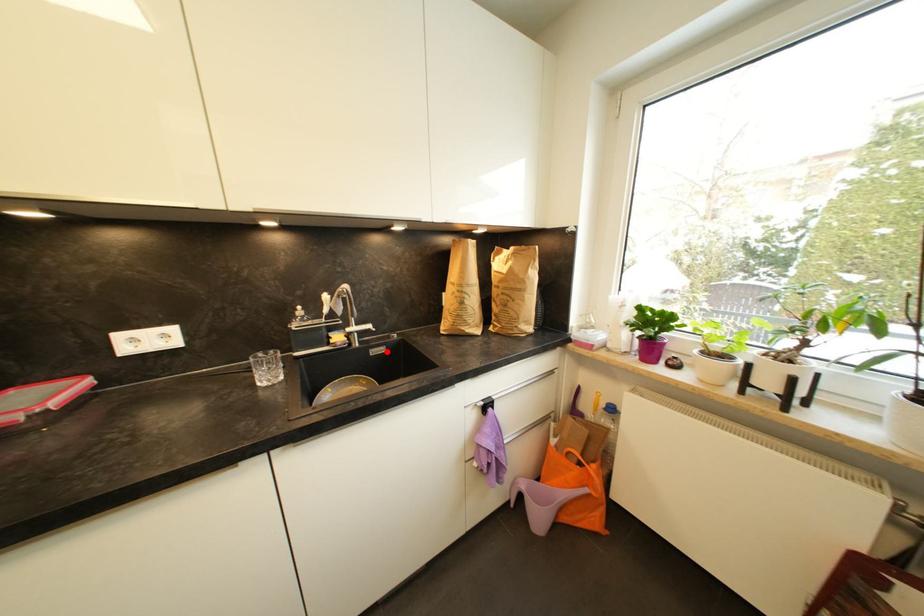
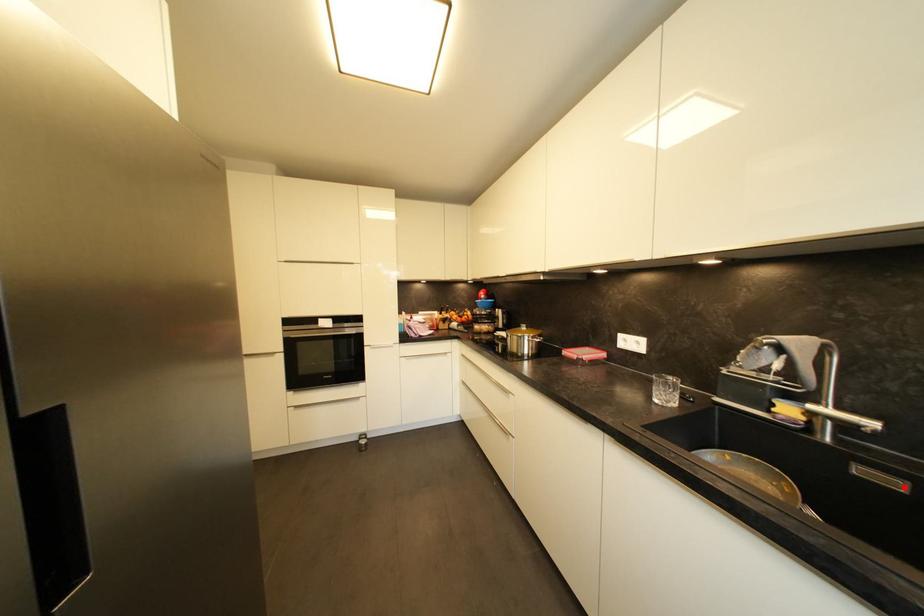
I am providing you with two images of the same scene from different viewpoints. A red point is marked on the first image and another point is marked on the second image. Are the points marked in image1 and image2 representing the same 3D position?

Yes